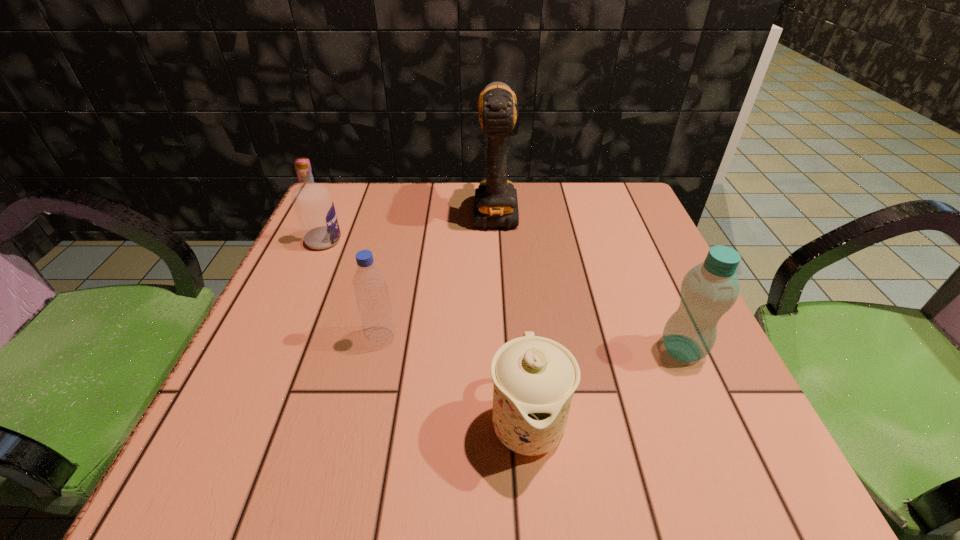
In order to click on object at the near edge in this screenshot , I will do `click(534, 378)`.

Locate an element on the screen. Image resolution: width=960 pixels, height=540 pixels. object that is at the left edge is located at coordinates (312, 202).

At what (x,y) coordinates should I click in order to perform the action: click on object that is at the right edge. Please return your answer as a coordinate pair (x, y). Looking at the image, I should click on pos(708,290).

In order to click on object that is at the far left corner in this screenshot , I will do `click(312, 202)`.

At what (x,y) coordinates should I click in order to perform the action: click on vacant space at the far edge. Please return your answer as a coordinate pair (x, y). This screenshot has height=540, width=960. Looking at the image, I should click on (406, 195).

Where is `blank space at the near edge of the desktop`? This screenshot has width=960, height=540. blank space at the near edge of the desktop is located at coordinates (647, 454).

Image resolution: width=960 pixels, height=540 pixels. I want to click on vacant area at the left edge, so click(342, 283).

Identify the location of free space at the right edge of the desktop. pyautogui.click(x=681, y=286).

In the image, there is a desktop. At what (x,y) coordinates should I click in order to perform the action: click on vacant space at the far left corner. Please return your answer as a coordinate pair (x, y). The image size is (960, 540). Looking at the image, I should click on (378, 212).

In the image, there is a desktop. What are the coordinates of `vacant region at the far right corner` in the screenshot? It's located at (588, 183).